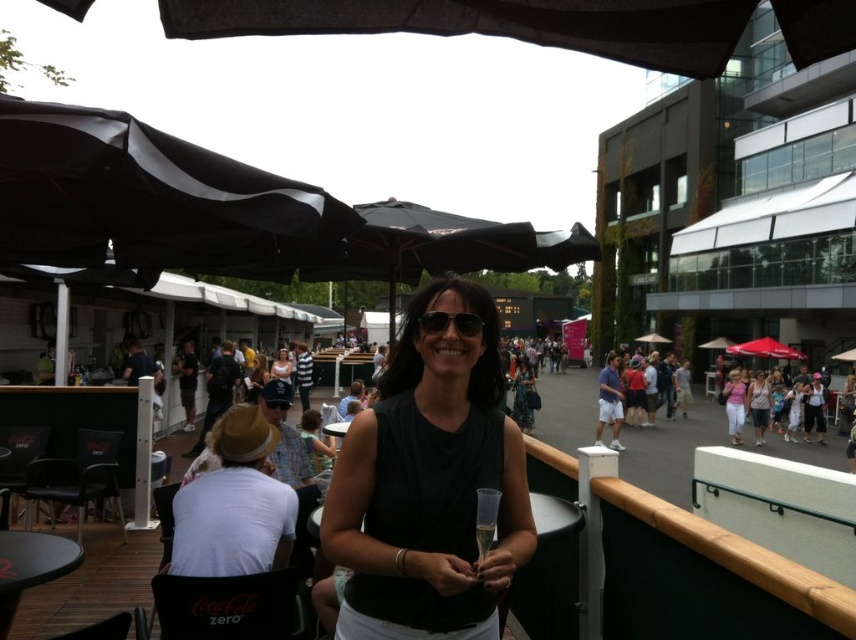
Question: Where is black plastic table at lower left located in relation to matte pink tank top at center in the image?

Choices:
 (A) left
 (B) right

Answer: (A)

Question: Which object appears closest to the camera in this image?

Choices:
 (A) pink fabric dress at center
 (B) black plastic sunglasses at center

Answer: (B)

Question: From the image, what is the correct spatial relationship of black matte umbrella at upper left in relation to black plastic sunglasses at center?

Choices:
 (A) right
 (B) left

Answer: (B)

Question: Is black matte dress at center closer to the viewer compared to red fabric umbrella at center?

Choices:
 (A) no
 (B) yes

Answer: (B)

Question: Among these objects, which one is nearest to the camera?

Choices:
 (A) black plastic sunglasses at center
 (B) black plastic table at lower left
 (C) black matte umbrella at upper left

Answer: (A)

Question: Which object appears closest to the camera in this image?

Choices:
 (A) black fabric umbrella at center
 (B) clear glass champagne flute at center

Answer: (B)